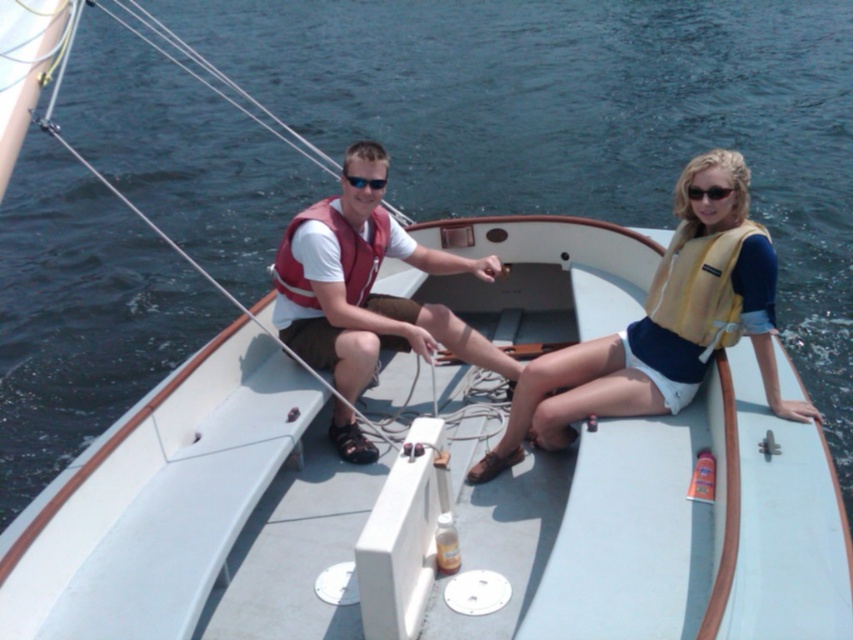
Does yellow/yellowish fabric life jacket at upper right appear over matte red life jacket at center?

Actually, yellow/yellowish fabric life jacket at upper right is below matte red life jacket at center.

Is yellow/yellowish fabric life jacket at upper right to the right of matte red life jacket at center from the viewer's perspective?

Yes, yellow/yellowish fabric life jacket at upper right is to the right of matte red life jacket at center.

The height and width of the screenshot is (640, 853). What are the coordinates of `yellow/yellowish fabric life jacket at upper right` in the screenshot? It's located at (700, 285).

Between matte red life jacket at center and black plastic sunglasses at upper right, which one is positioned lower?

matte red life jacket at center is lower down.

Where is `matte red life jacket at center`? The width and height of the screenshot is (853, 640). matte red life jacket at center is located at coordinates (339, 253).

Is matte red life vest at center bigger than sunglasses at center?

Correct, matte red life vest at center is larger in size than sunglasses at center.

Can you confirm if matte red life vest at center is positioned above sunglasses at center?

No.

This screenshot has width=853, height=640. In order to click on matte red life vest at center in this screenshot , I will do (x=366, y=285).